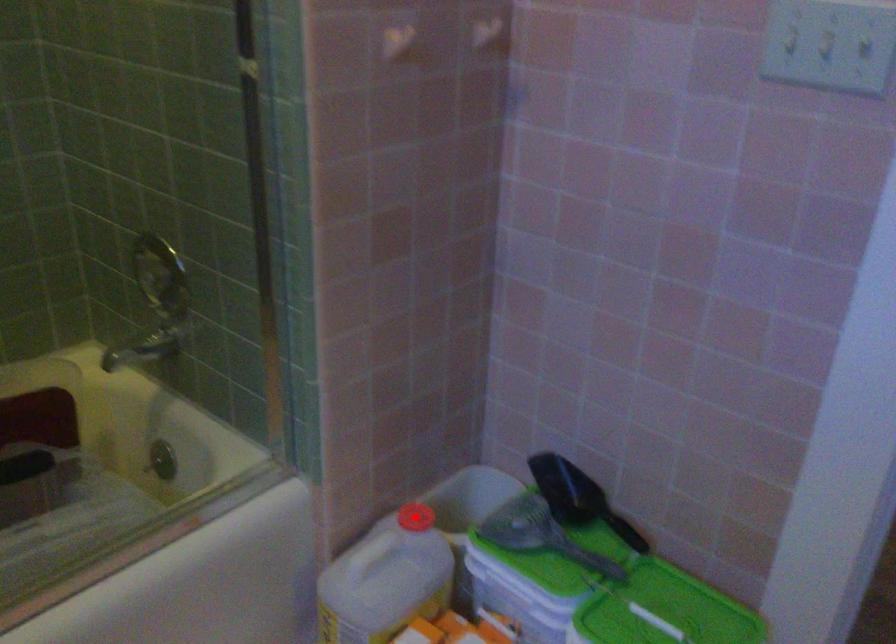
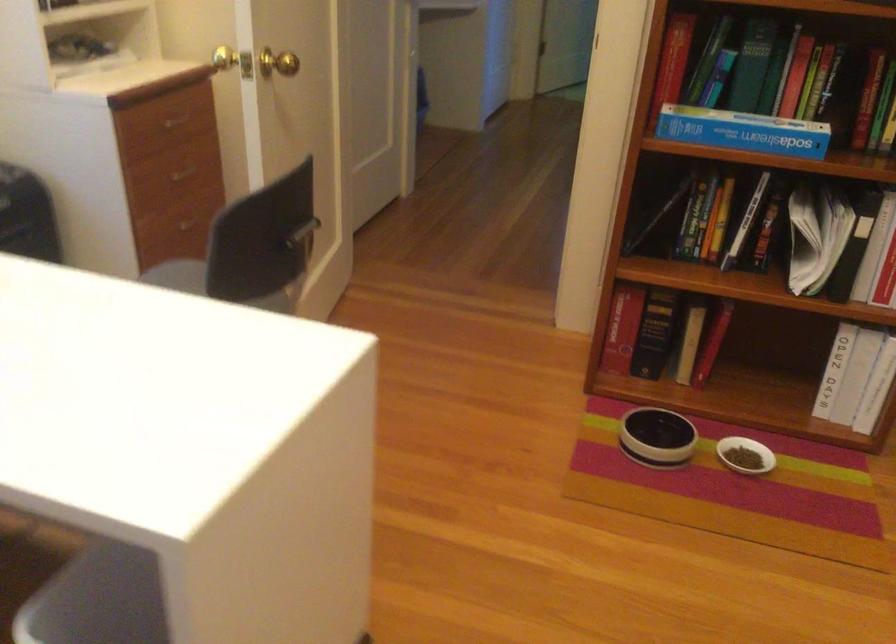
Question: I am providing you with two images of the same scene from different viewpoints. A red point is marked on the first image. At the location where the point appears in image 1, is it still visible in image 2?

Choices:
 (A) Yes
 (B) No

Answer: (B)